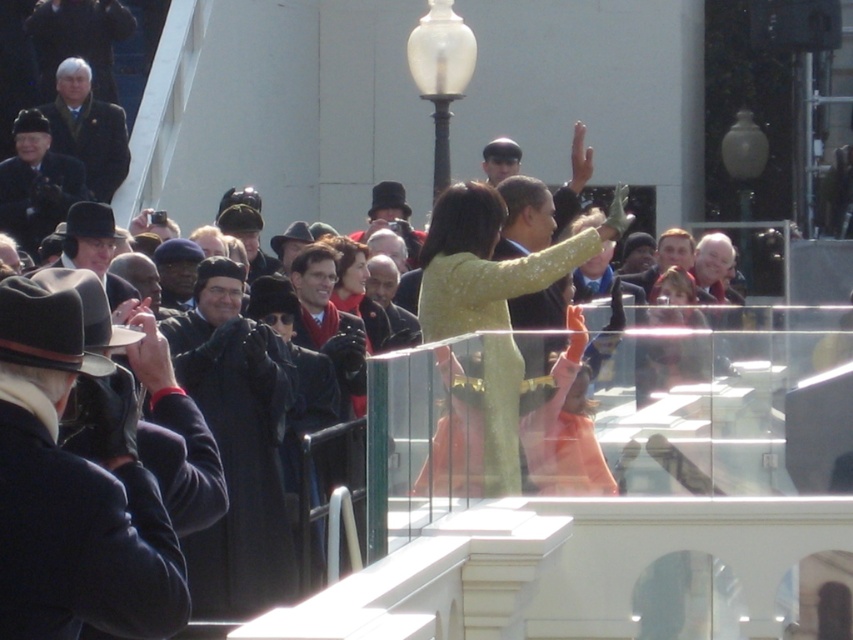
Who is more forward, (x=73, y=301) or (x=73, y=83)?

Point (x=73, y=301) is in front.

Does dark brown leather hat at left appear on the left side of dark gray suit at upper left?

No, dark brown leather hat at left is not to the left of dark gray suit at upper left.

Between point (90, 365) and point (86, 179), which one is positioned in front?

Point (90, 365) is more forward.

This screenshot has width=853, height=640. In order to click on dark brown leather hat at left in this screenshot , I will do `click(74, 486)`.

Who is shorter, dark brown leather hat at left or black matte coat at center?

Standing shorter between the two is black matte coat at center.

In the scene shown: Who is lower down, dark brown leather hat at left or black matte coat at center?

Positioned lower is dark brown leather hat at left.

Measure the distance between dark brown leather hat at left and camera.

dark brown leather hat at left and camera are 84.56 feet apart from each other.

This screenshot has height=640, width=853. In order to click on dark brown leather hat at left in this screenshot , I will do `click(74, 486)`.

Measure the distance between point (492, 356) and camera.

38.10 meters

Does shiny gold dress at center have a lesser height compared to dark gray suit at upper left?

Correct, shiny gold dress at center is not as tall as dark gray suit at upper left.

Which is in front, point (437, 305) or point (106, 124)?

Point (437, 305) is more forward.

Where is `shiny gold dress at center`? This screenshot has width=853, height=640. shiny gold dress at center is located at coordinates (491, 260).